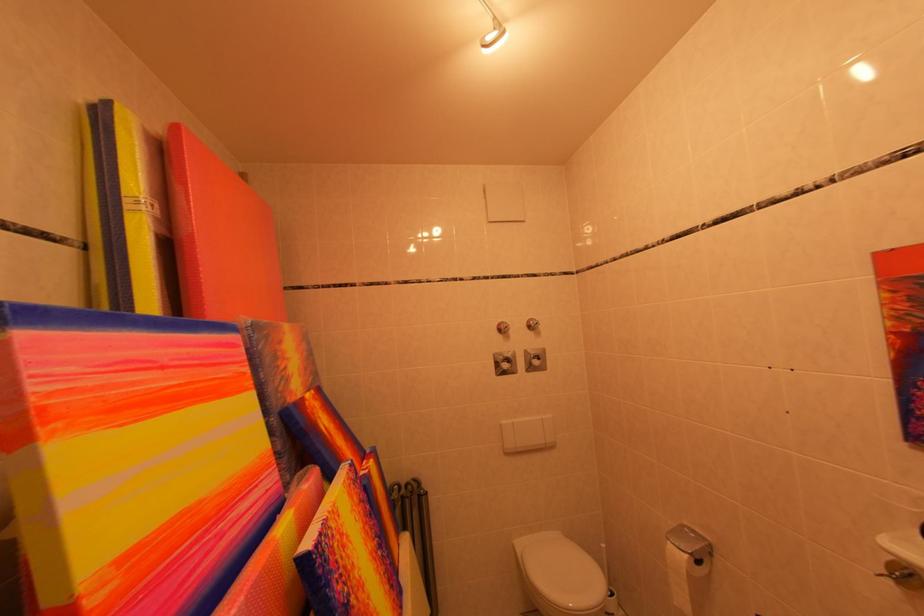
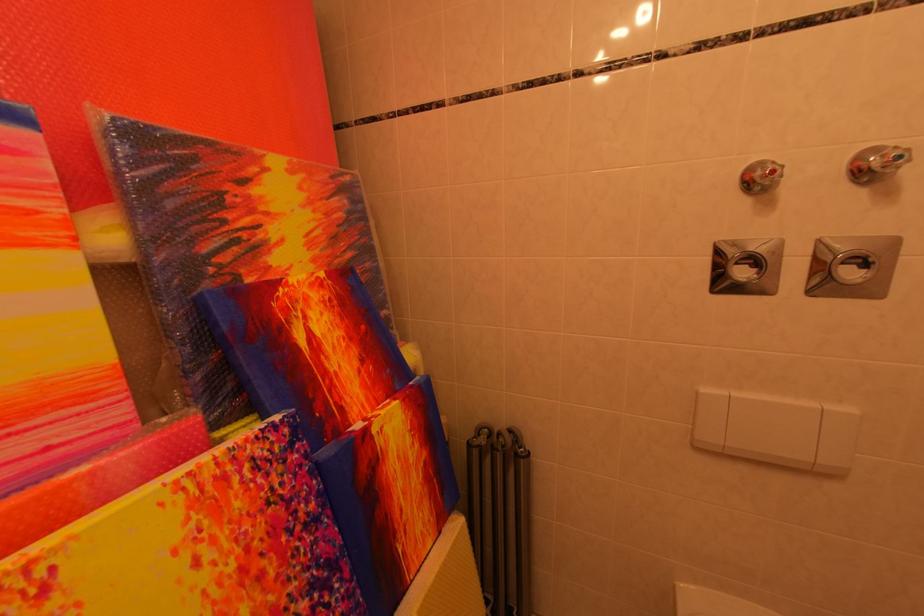
Where in the second image is the point corresponding to point (545, 363) from the first image?

(864, 270)